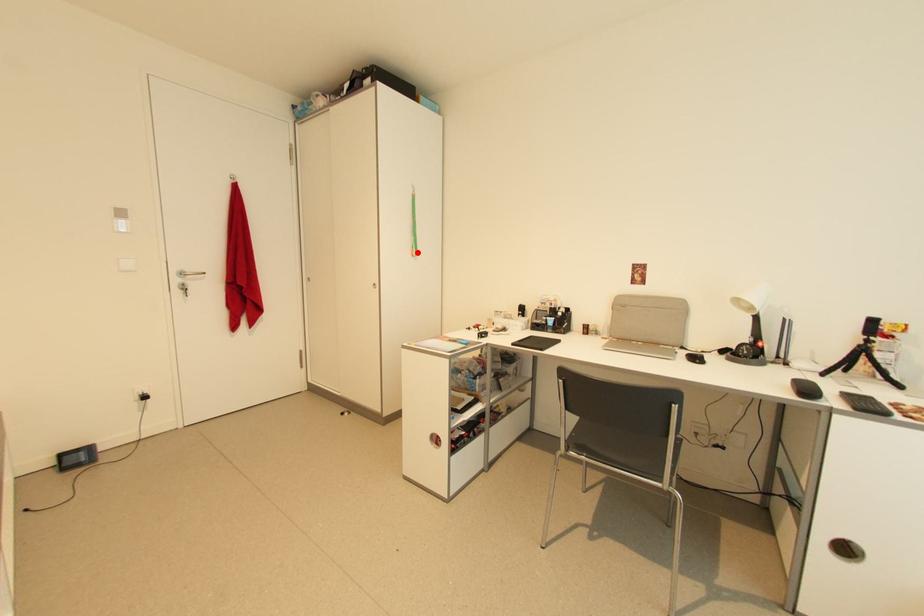
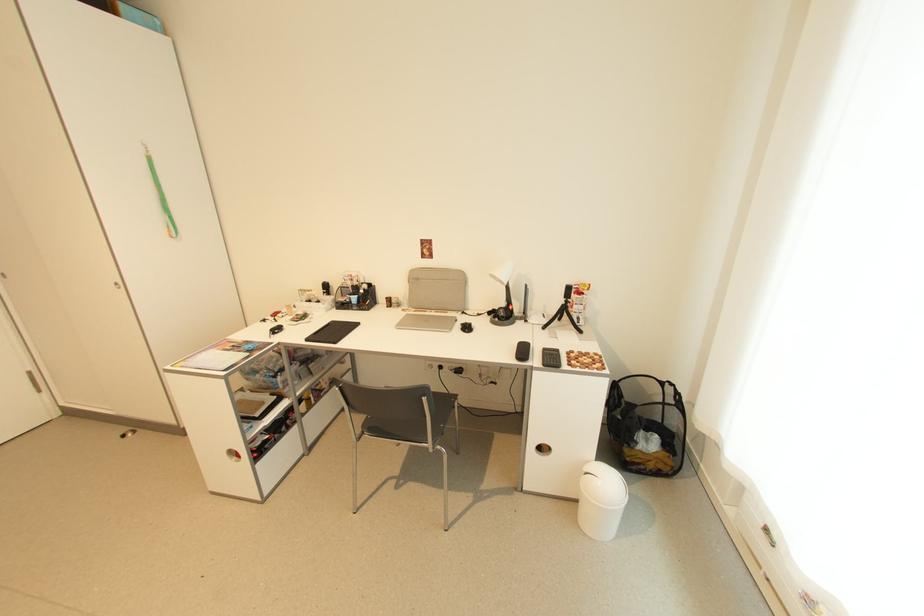
Find the pixel in the second image that matches the highlighted location in the first image.

(175, 233)